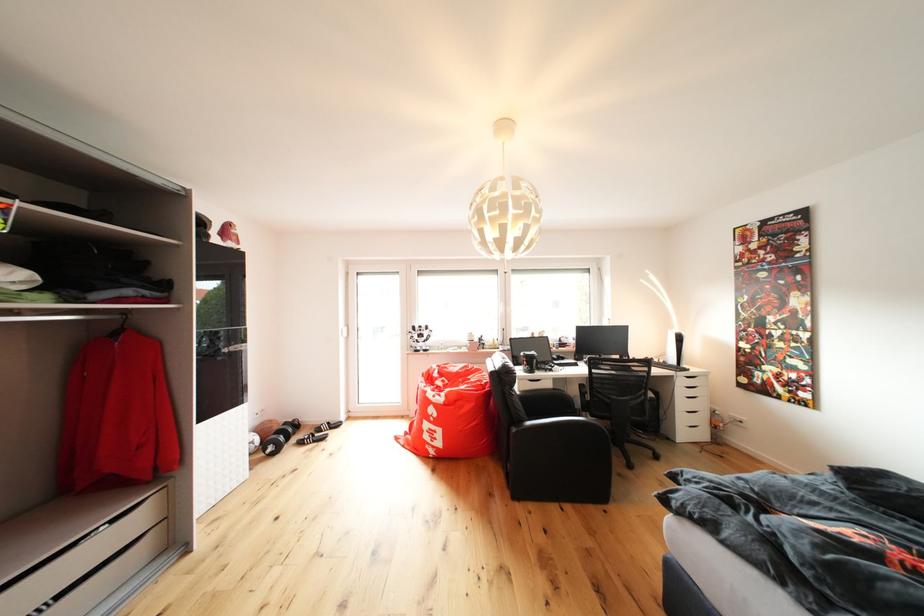
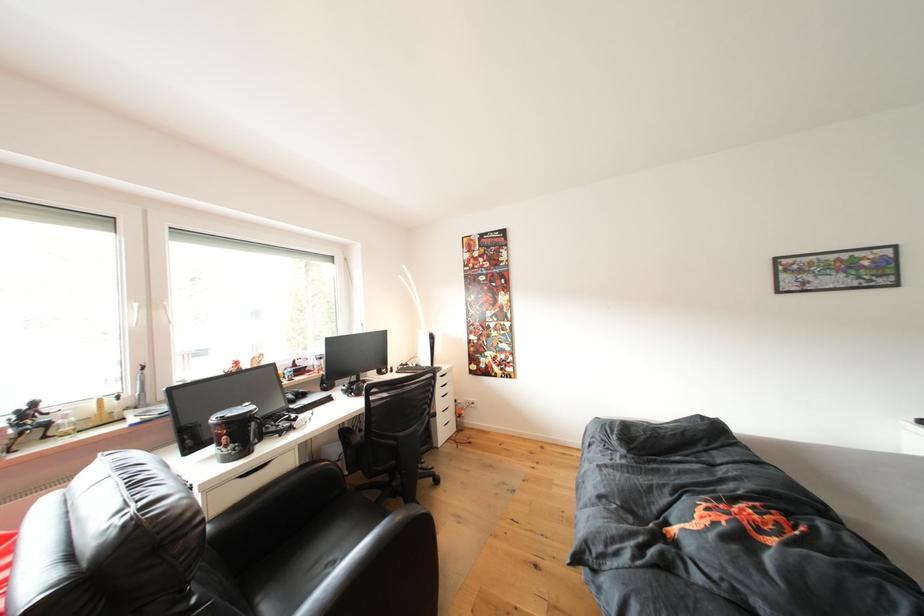
The point at (694, 371) is marked in the first image. Where is the corresponding point in the second image?

(444, 370)